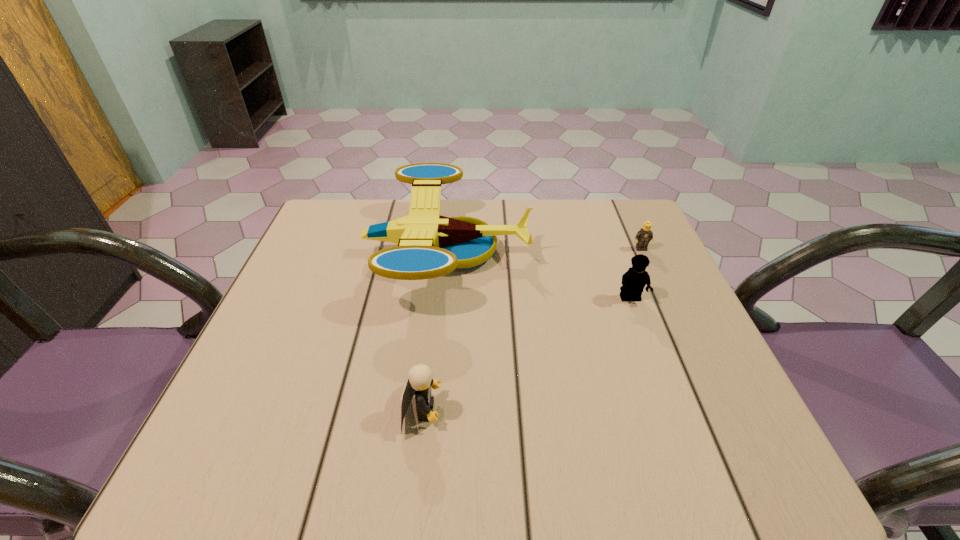
Find the location of a particular element. This screenshot has width=960, height=540. vacant area situated in front of the rightmost object is located at coordinates (665, 303).

Find the location of a particular element. This screenshot has width=960, height=540. drone located in the far edge section of the desktop is located at coordinates (430, 245).

You are a GUI agent. You are given a task and a screenshot of the screen. Output one action in this format:
    pyautogui.click(x=<x>, y=<y>)
    Task: Click on the Lego present at the far edge
    The image size is (960, 540).
    Given the screenshot: What is the action you would take?
    pyautogui.click(x=644, y=235)

Identify the location of object that is positioned at the near edge. This screenshot has width=960, height=540. click(x=420, y=381).

What are the coordinates of `object present at the far right corner` in the screenshot? It's located at (644, 235).

In the image, there is a desktop. Where is `vacant space at the far edge`? vacant space at the far edge is located at coordinates (394, 214).

You are a GUI agent. You are given a task and a screenshot of the screen. Output one action in this format:
    pyautogui.click(x=<x>, y=<y>)
    Task: Click on the free space at the near edge
    This screenshot has height=540, width=960.
    Given the screenshot: What is the action you would take?
    pyautogui.click(x=500, y=443)

The image size is (960, 540). What are the coordinates of `free location at the left edge of the desktop` in the screenshot? It's located at (226, 411).

Where is `vacant space at the right edge of the desktop`? vacant space at the right edge of the desktop is located at coordinates (691, 338).

The height and width of the screenshot is (540, 960). I want to click on vacant space at the far left corner of the desktop, so click(x=334, y=203).